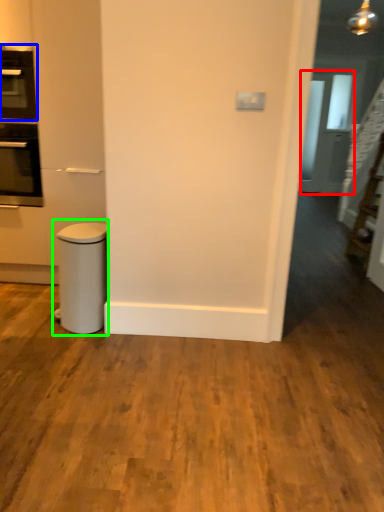
Question: Estimate the real-world distances between objects in this image. Which object is farther from glass door (highlighted by a red box), home appliance (highlighted by a blue box) or waste container (highlighted by a green box)?

Choices:
 (A) home appliance
 (B) waste container

Answer: (B)